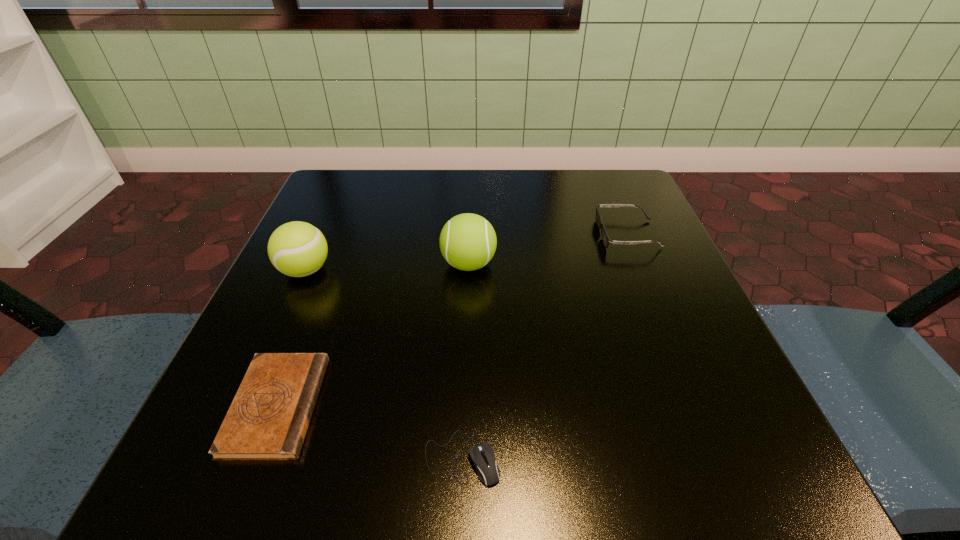
The width and height of the screenshot is (960, 540). I want to click on vacant space located on the front-facing side of the sunglasses, so click(x=509, y=234).

The width and height of the screenshot is (960, 540). What are the coordinates of `free spot located on the left of the computer mouse` in the screenshot? It's located at (336, 457).

What are the coordinates of `vacant space situated 0.170m on the spine side of the diary` in the screenshot? It's located at (441, 406).

You are a GUI agent. You are given a task and a screenshot of the screen. Output one action in this format:
    pyautogui.click(x=<x>, y=<y>)
    Task: Click on the object positioned at the far edge
    The height and width of the screenshot is (540, 960).
    Given the screenshot: What is the action you would take?
    pyautogui.click(x=606, y=240)

Find the location of a particular element. computer mouse located at the near edge is located at coordinates (482, 455).

At what (x,y) coordinates should I click in order to perform the action: click on diary present at the near edge. Please return your answer as a coordinate pair (x, y). This screenshot has width=960, height=540. Looking at the image, I should click on (269, 416).

Find the location of a particular element. The width and height of the screenshot is (960, 540). tennis ball located in the left edge section of the desktop is located at coordinates (297, 249).

You are a GUI agent. You are given a task and a screenshot of the screen. Output one action in this format:
    pyautogui.click(x=<x>, y=<y>)
    Task: Click on the diary that is positioned at the left edge
    
    Given the screenshot: What is the action you would take?
    pyautogui.click(x=269, y=416)

The image size is (960, 540). In order to click on object that is at the right edge in this screenshot , I will do `click(606, 240)`.

You are a GUI agent. You are given a task and a screenshot of the screen. Output one action in this format:
    pyautogui.click(x=<x>, y=<y>)
    Task: Click on the object that is positioned at the near left corner
    This screenshot has width=960, height=540.
    Given the screenshot: What is the action you would take?
    pyautogui.click(x=269, y=416)